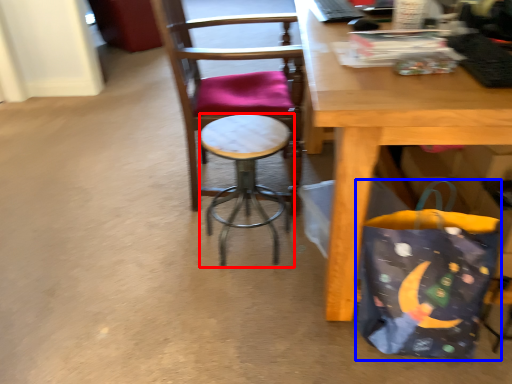
Question: Which object is further to the camera taking this photo, stool (highlighted by a red box) or grocery bag (highlighted by a blue box)?

Choices:
 (A) stool
 (B) grocery bag

Answer: (A)